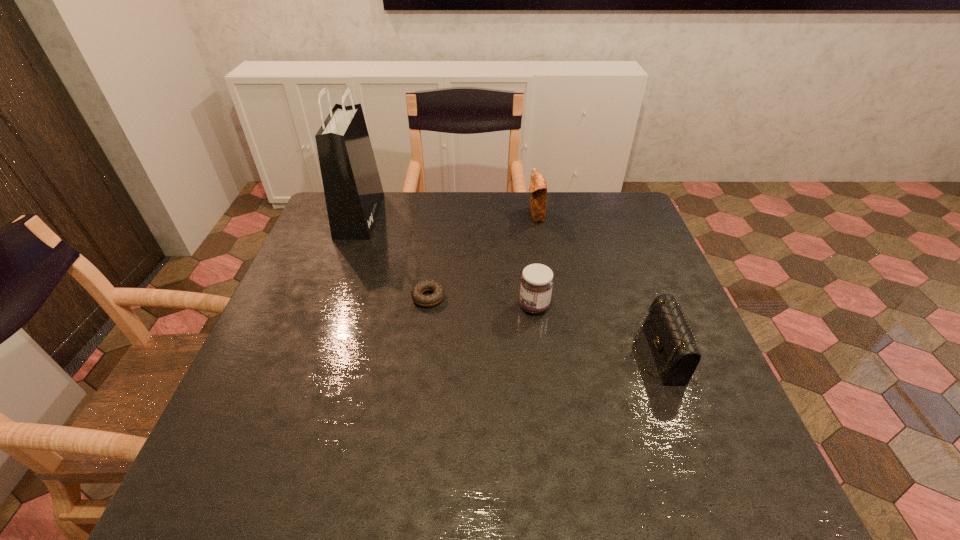
At what (x,y) coordinates should I click in order to perform the action: click on shopping bag that is at the far edge. Please return your answer as a coordinate pair (x, y). This screenshot has width=960, height=540. Looking at the image, I should click on (353, 191).

This screenshot has width=960, height=540. Find the location of `clutch bag located at the far edge`. clutch bag located at the far edge is located at coordinates (538, 188).

Where is `object situated at the left edge`? object situated at the left edge is located at coordinates (353, 191).

Where is `object situated at the right edge`? The image size is (960, 540). object situated at the right edge is located at coordinates [672, 342].

The image size is (960, 540). What are the coordinates of `object that is at the far left corner` in the screenshot? It's located at (353, 191).

Where is `vacant space at the far edge`? The width and height of the screenshot is (960, 540). vacant space at the far edge is located at coordinates (423, 193).

Image resolution: width=960 pixels, height=540 pixels. I want to click on vacant space at the near edge, so click(566, 460).

Find the location of a particular element. free region at the left edge is located at coordinates (336, 273).

Identify the location of free space at the right edge. The image size is (960, 540). (641, 342).

Locate an element on the screen. free location at the near right corner is located at coordinates (752, 489).